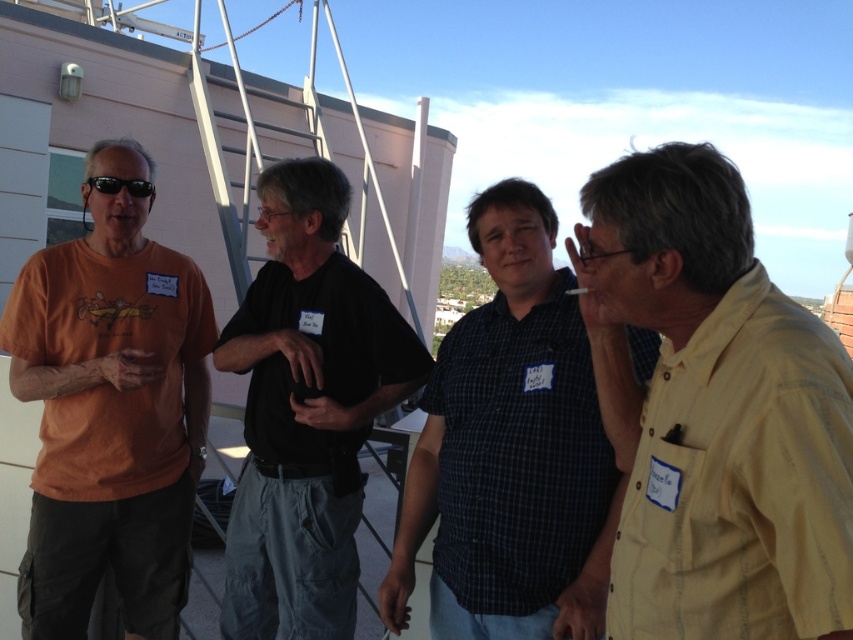
Looking at the two men in the image, the yellow cotton shirt at right and the dark blue checkered shirt at center, which one appears shorter?

The yellow cotton shirt at right is shorter than the dark blue checkered shirt at center.

You are a photographer trying to capture a group photo of the dark blue checkered shirt at center and the black cotton shirt at center. Which man should you position closer to the camera to ensure both are in focus?

The dark blue checkered shirt at center is shorter than the black cotton shirt at center, so positioning the dark blue checkered shirt at center closer to the camera will help keep both in focus.